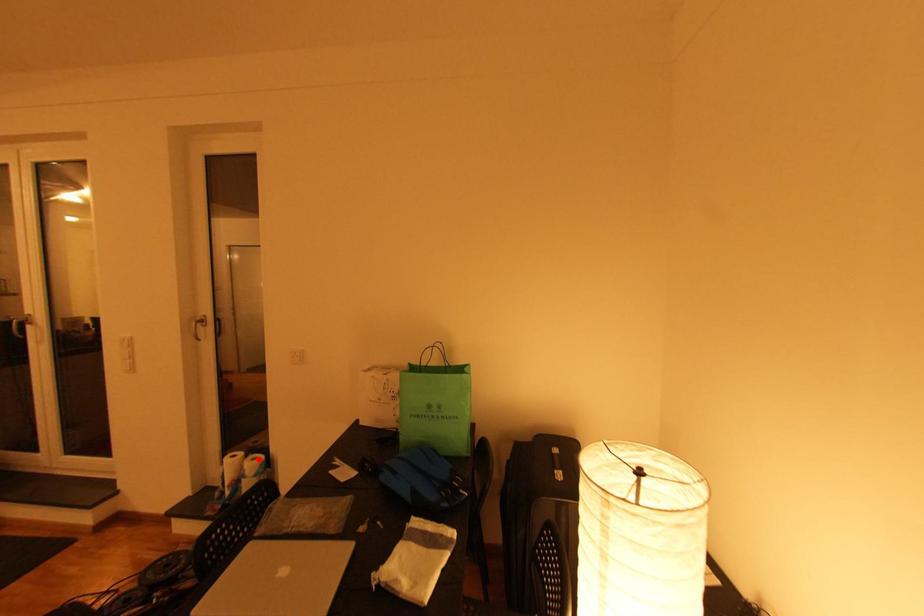
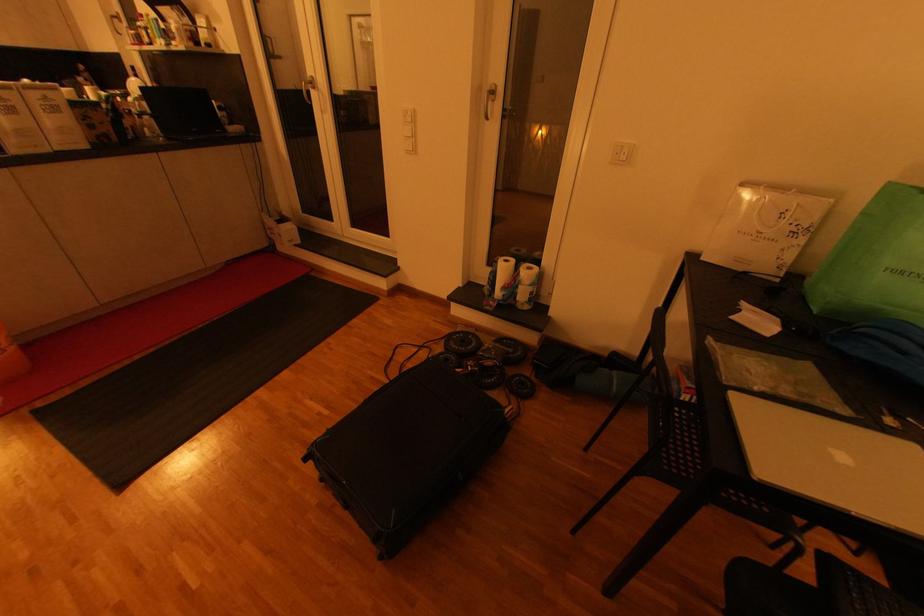
Find the pixel in the second image that matches the highlighted location in the first image.

(533, 269)